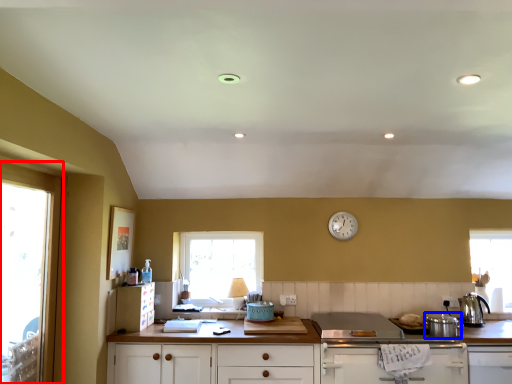
Question: Which point is further to the camera, window (highlighted by a red box) or appliance (highlighted by a blue box)?

Choices:
 (A) window
 (B) appliance

Answer: (B)